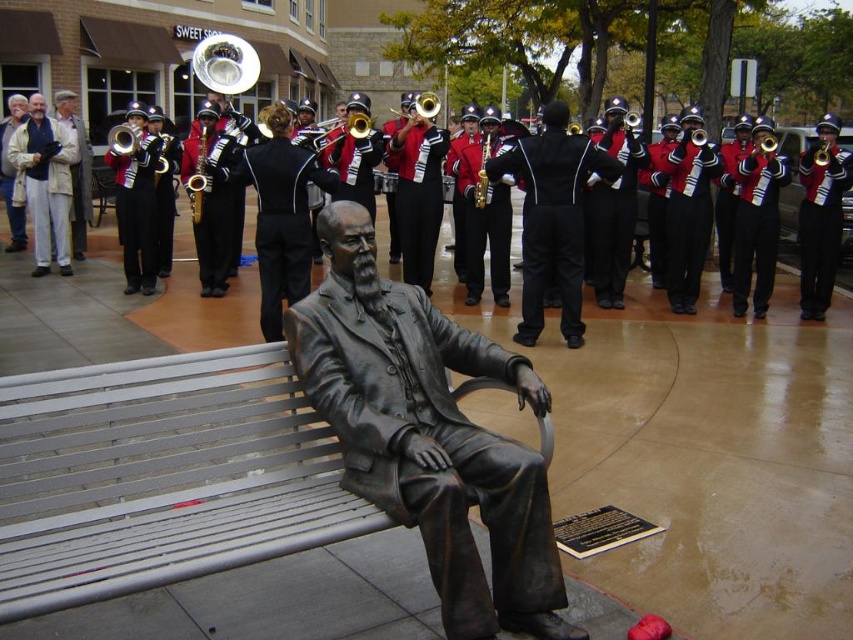
Question: Is bronze statue at center to the left of brass saxophone at center from the viewer's perspective?

Choices:
 (A) yes
 (B) no

Answer: (B)

Question: Which object is the farthest from the bronze saxophone at center?

Choices:
 (A) bronze statue at center
 (B) silver metallic bench at center

Answer: (B)

Question: Observing the image, what is the correct spatial positioning of silver metallic bench at center in reference to bronze statue at center?

Choices:
 (A) above
 (B) below

Answer: (B)

Question: In this image, where is bronze statue at center located relative to bronze saxophone at center?

Choices:
 (A) left
 (B) right

Answer: (A)

Question: Which of the following is the closest to the observer?

Choices:
 (A) (138, 570)
 (B) (502, 612)

Answer: (A)

Question: Estimate the real-world distances between objects in this image. Which object is closer to the bronze saxophone at center?

Choices:
 (A) silver metallic bench at center
 (B) bronze statue at center
 (C) shiny gold trumpet at center
 (D) brass saxophone at center

Answer: (D)